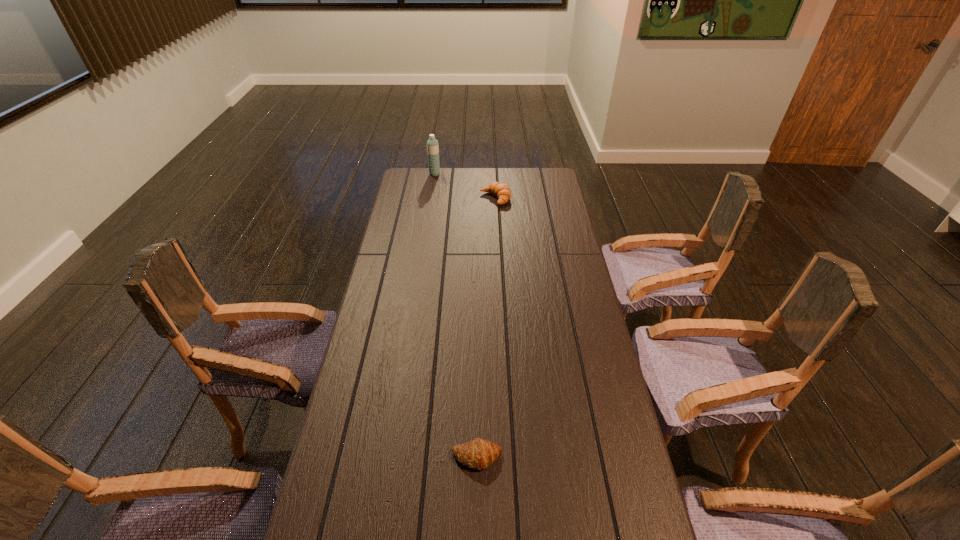
Where is `water bottle`? The image size is (960, 540). water bottle is located at coordinates (432, 144).

Locate an element on the screen. Image resolution: width=960 pixels, height=540 pixels. the leftmost object is located at coordinates (432, 144).

Where is `the farther crescent roll`? Image resolution: width=960 pixels, height=540 pixels. the farther crescent roll is located at coordinates (502, 191).

Where is `the second tallest object`? the second tallest object is located at coordinates (502, 191).

Find the location of `the shortest object`. the shortest object is located at coordinates (479, 453).

The height and width of the screenshot is (540, 960). I want to click on the shorter crescent roll, so click(x=479, y=453).

The height and width of the screenshot is (540, 960). What are the coordinates of `free spot located on the front of the water bottle` in the screenshot? It's located at (427, 222).

Identify the location of free spot located on the left of the second tallest object. (443, 199).

Locate an element on the screen. The width and height of the screenshot is (960, 540). vacant space situated on the back of the nearer crescent roll is located at coordinates (477, 389).

This screenshot has width=960, height=540. In order to click on water bottle at the far edge in this screenshot , I will do `click(432, 144)`.